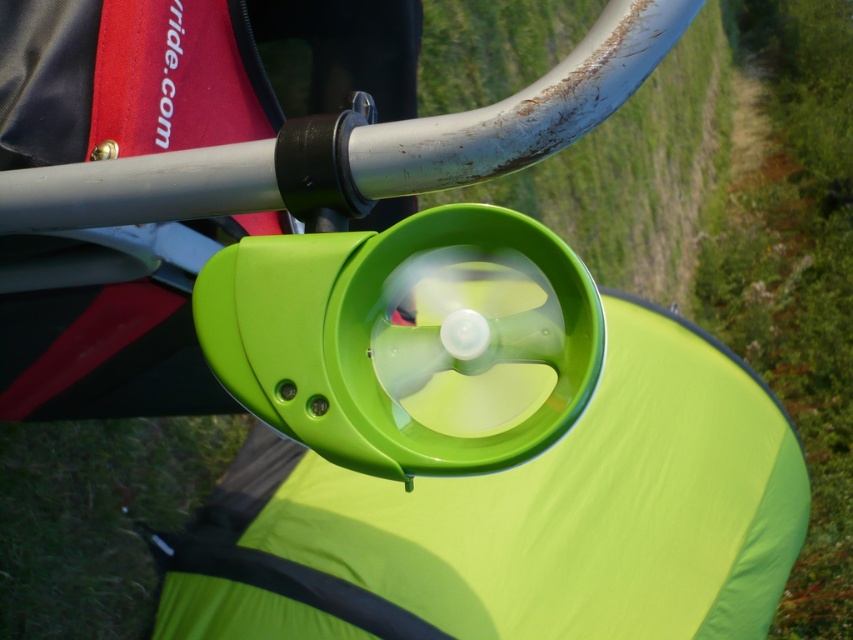
You are a parent pushing a stroller and want to place a water bottle in the cup holder. Considering the green matte grass at upper center and the green grass at lower left, which area is wider?

The green matte grass at upper center is wider than the green grass at lower left.

You are a parent pushing a stroller through a park and notice the green matte grass at upper center and the green grass at lower left in your view. Which area of grass is closer to you as you look through the stroller handlebars?

The green matte grass at upper center is closer to you because it is further to the viewer than the green grass at lower left.

You are a parent pushing a stroller and want to place a small toy on the grass. Which grass area, the green matte grass at upper center or the green grass at lower left, should you aim for to place the toy so it stays visible?

The green matte grass at upper center is positioned over green grass at lower left, so placing the toy on the green matte grass at upper center will keep it visible as it is above the other grass area.